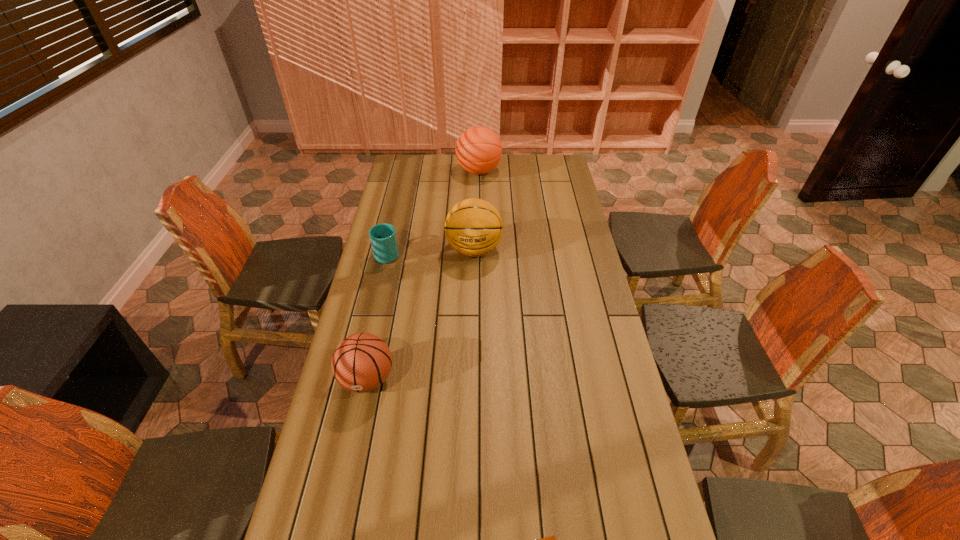
I want to click on the farthest basketball, so click(x=478, y=149).

Find the location of a particular element. This screenshot has height=540, width=960. the second farthest basketball is located at coordinates (473, 227).

You are a GUI agent. You are given a task and a screenshot of the screen. Output one action in this format:
    pyautogui.click(x=<x>, y=<y>)
    Task: Click on the nearest basketball
    The image size is (960, 540).
    Given the screenshot: What is the action you would take?
    pyautogui.click(x=361, y=362)

This screenshot has height=540, width=960. Find the location of `the fourth farthest object`. the fourth farthest object is located at coordinates (361, 362).

Locate an element on the screen. The width and height of the screenshot is (960, 540). the fourth tallest object is located at coordinates pos(383,239).

At what (x,y) coordinates should I click in order to perform the action: click on vacant space situated 0.390m on the front of the farthest object. Please return your answer as a coordinate pair (x, y). This screenshot has width=960, height=540. Looking at the image, I should click on (478, 232).

The width and height of the screenshot is (960, 540). Identify the location of free space located 0.200m on the surface of the second farthest basketball near the brand logo. (473, 306).

The height and width of the screenshot is (540, 960). I want to click on blank space located 0.170m on the side where the inflation valve is located, so click(x=349, y=461).

Where is `free space located 0.120m on the handle side of the cup`? The width and height of the screenshot is (960, 540). free space located 0.120m on the handle side of the cup is located at coordinates (394, 225).

Where is `vacant point located on the handle side of the cup`? Image resolution: width=960 pixels, height=540 pixels. vacant point located on the handle side of the cup is located at coordinates (400, 197).